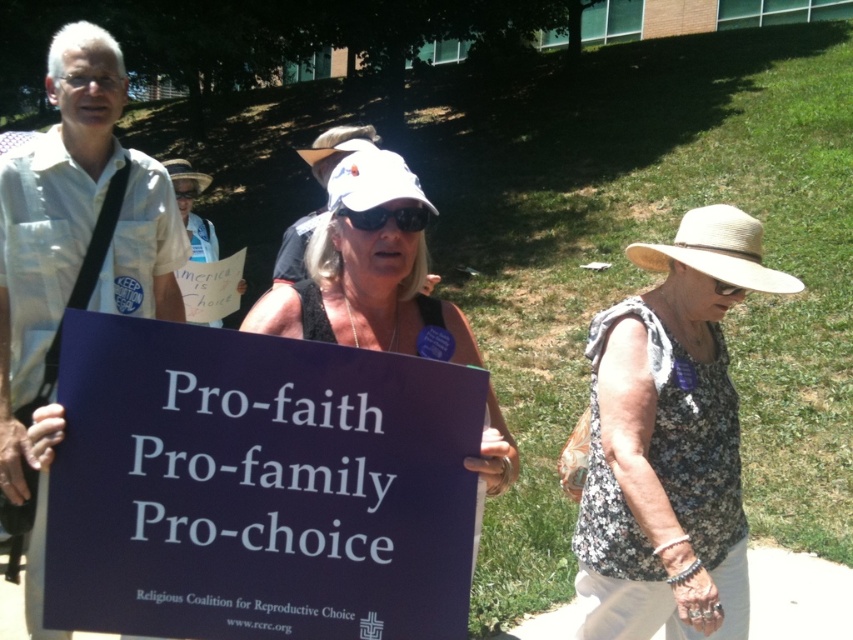
You are a photographer trying to capture the best angle of the scene. You notice two points of interest at coordinates point (589, 353) and point (410, 333). Which point is closer to your camera lens?

Point (410, 333) is closer to the camera lens because it is less further to the viewer than point (589, 353).

You are a photographer trying to capture a clear photo of the dark blue paper sign at center and the white fabric hat at center. Which object should you focus on first to ensure both are in frame without moving the camera?

The dark blue paper sign at center is shorter than the white fabric hat at center, so you should focus on the white fabric hat at center first to ensure both are in frame without moving the camera.